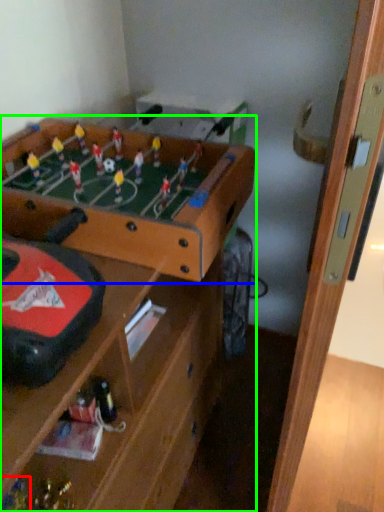
Question: Considering the real-world distances, which object is farthest from toy (highlighted by a red box)? table (highlighted by a blue box) or table (highlighted by a green box)?

Choices:
 (A) table
 (B) table

Answer: (A)